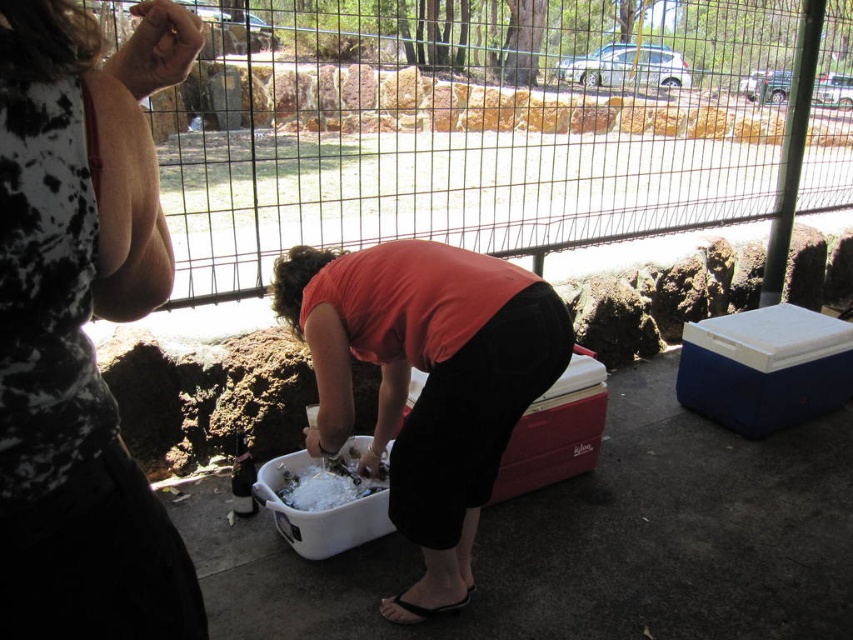
Question: Does metal mesh fence at upper center have a larger size compared to matte black shirt at center?

Choices:
 (A) no
 (B) yes

Answer: (B)

Question: Which of the following is the farthest from the observer?

Choices:
 (A) click(610, 180)
 (B) click(122, 477)
 (C) click(329, 499)
 (D) click(398, 333)

Answer: (A)

Question: Which point is farther to the camera?

Choices:
 (A) metal mesh fence at upper center
 (B) white plastic bucket at center
 (C) white plastic bucket at lower center

Answer: (C)

Question: Which object appears farthest from the camera in this image?

Choices:
 (A) matte black shirt at center
 (B) metal mesh fence at upper center
 (C) white plastic bucket at lower center
 (D) white plastic bucket at center

Answer: (C)

Question: Can you confirm if metal mesh fence at upper center is smaller than white plastic bucket at center?

Choices:
 (A) no
 (B) yes

Answer: (A)

Question: Does matte black shirt at center come in front of white plastic bucket at center?

Choices:
 (A) yes
 (B) no

Answer: (A)